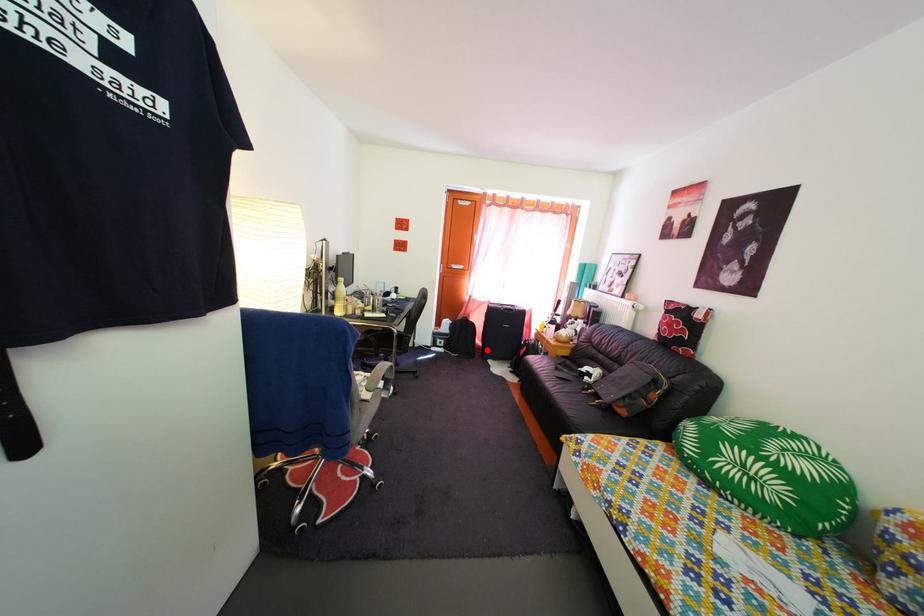
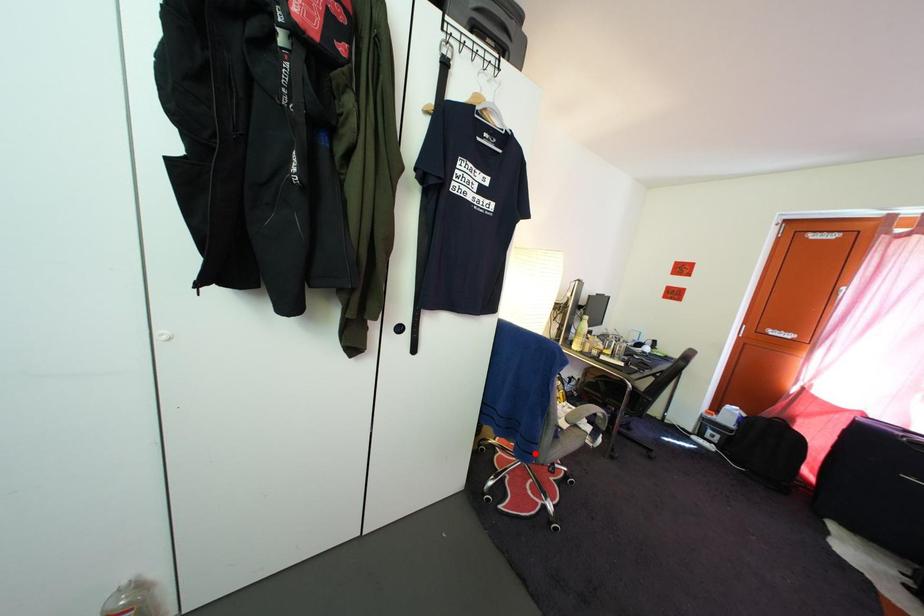
I am providing you with two images of the same scene from different viewpoints. A red point is marked on the first image and another point is marked on the second image. Do the highlighted points in image1 and image2 indicate the same real-world spot?

No